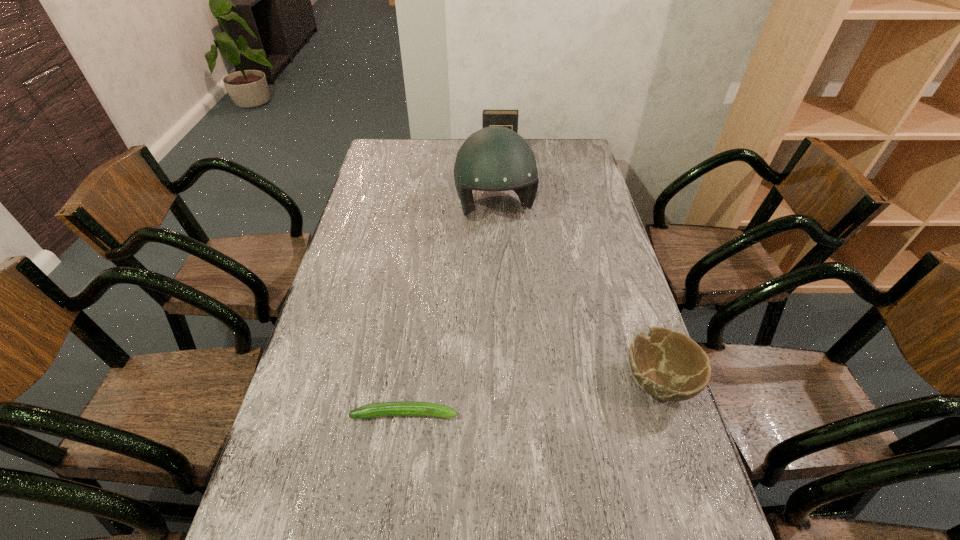
Where is `vacant space on the desktop that is between the zucchini and the bowl and is positioned at the face opening of the second farthest object`? vacant space on the desktop that is between the zucchini and the bowl and is positioned at the face opening of the second farthest object is located at coordinates (554, 394).

You are a GUI agent. You are given a task and a screenshot of the screen. Output one action in this format:
    pyautogui.click(x=<x>, y=<y>)
    Task: Click on the vacant spot on the desktop that is between the zucchini and the third tallest object and is positioned on the front cover of the farthest object
    This screenshot has width=960, height=540.
    Given the screenshot: What is the action you would take?
    pyautogui.click(x=506, y=401)